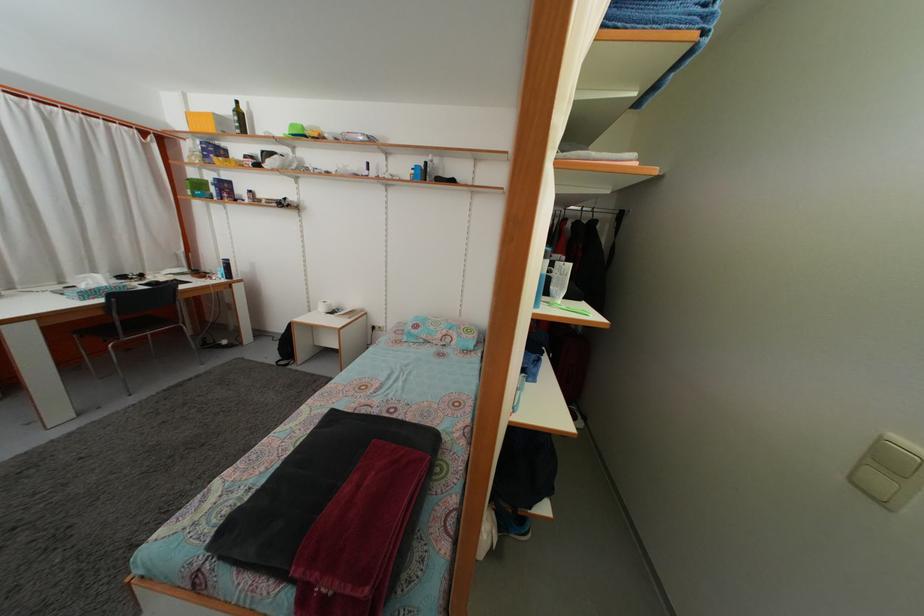
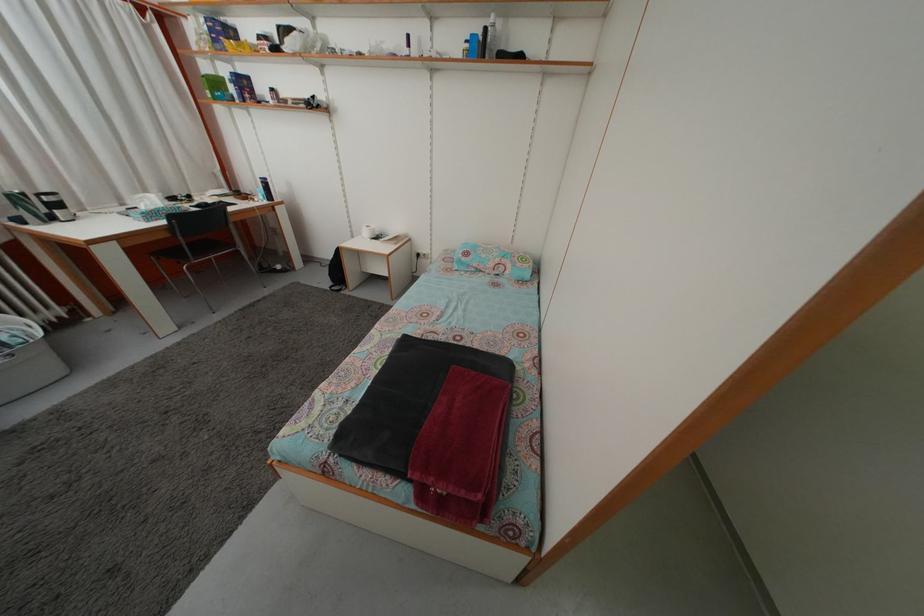
In a continuous first-person perspective shot, in which direction is the camera moving?

The cameraman moved toward left, forward.